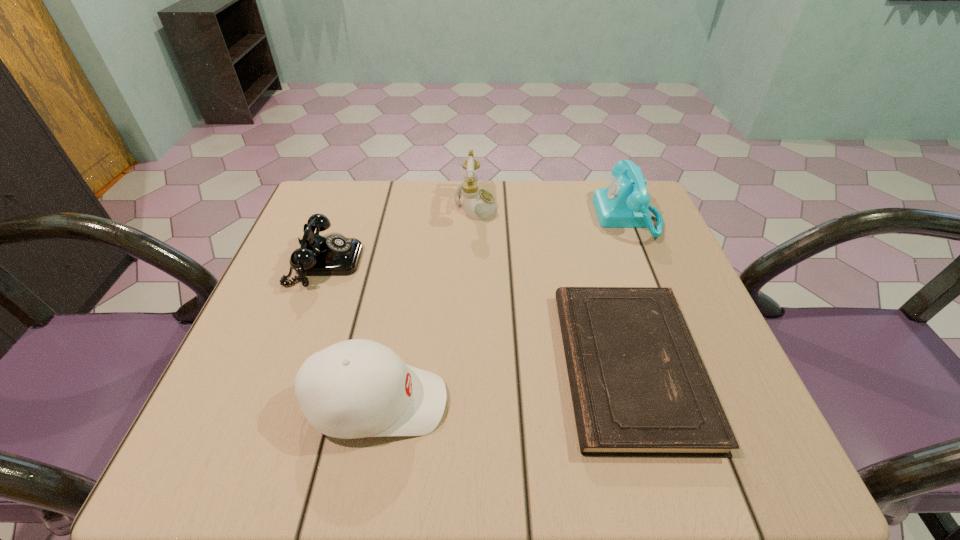
At what (x,y) coordinates should I click in order to perform the action: click on free area in between the second telephone from right to left and the second shortest object. Please return your answer as a coordinate pair (x, y). The width and height of the screenshot is (960, 540). Looking at the image, I should click on (400, 233).

You are a GUI agent. You are given a task and a screenshot of the screen. Output one action in this format:
    pyautogui.click(x=<x>, y=<y>)
    Task: Click on the unoccupied area between the shortest telephone and the rightmost telephone
    This screenshot has width=960, height=540.
    Given the screenshot: What is the action you would take?
    pyautogui.click(x=476, y=239)

What are the coordinates of `unoccupied area between the shortest telephone and the paperback book` in the screenshot? It's located at (477, 314).

Locate an element on the screen. This screenshot has height=540, width=960. free space between the second shortest object and the second telephone from left to right is located at coordinates (400, 233).

You are a GUI agent. You are given a task and a screenshot of the screen. Output one action in this format:
    pyautogui.click(x=<x>, y=<y>)
    Task: Click on the unoccupied position between the second telephone from left to right and the shortest telephone
    This screenshot has width=960, height=540.
    Given the screenshot: What is the action you would take?
    pyautogui.click(x=400, y=233)

Find the location of a particular element. This screenshot has height=540, width=960. vacant space in between the baseball cap and the leftmost telephone is located at coordinates (351, 332).

Locate which object ranks second in proximity to the second telephone from left to right. Please provide its 2D coordinates. Your answer should be formatted as a tuple, i.e. [(x, y)], where the tuple contains the x and y coordinates of a point satisfying the conditions above.

[(625, 203)]

The height and width of the screenshot is (540, 960). Find the location of `object identified as the second closest to the baseball cap`. object identified as the second closest to the baseball cap is located at coordinates (639, 388).

Locate which telephone ranks in proximity to the rightmost telephone. Please provide its 2D coordinates. Your answer should be formatted as a tuple, i.e. [(x, y)], where the tuple contains the x and y coordinates of a point satisfying the conditions above.

[(479, 204)]

Locate an element on the screen. The image size is (960, 540). telephone that is the second closest one to the shortest object is located at coordinates (479, 204).